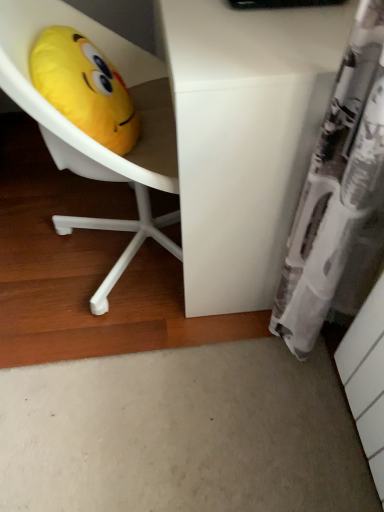
Question: Is yellow plush toy at upper left facing away from white matte desk at center?

Choices:
 (A) no
 (B) yes

Answer: (A)

Question: Would you say white matte desk at center is part of yellow plush toy at upper left's contents?

Choices:
 (A) no
 (B) yes

Answer: (A)

Question: Can you confirm if yellow plush toy at upper left is taller than white matte desk at center?

Choices:
 (A) yes
 (B) no

Answer: (B)

Question: From a real-world perspective, is yellow plush toy at upper left located beneath white matte desk at center?

Choices:
 (A) yes
 (B) no

Answer: (B)

Question: From the image's perspective, does yellow plush toy at upper left appear lower than white matte desk at center?

Choices:
 (A) no
 (B) yes

Answer: (B)

Question: Does yellow plush toy at upper left turn towards white matte desk at center?

Choices:
 (A) yes
 (B) no

Answer: (A)

Question: Considering the relative sizes of white matte desk at center and yellow plush toy at upper left in the image provided, is white matte desk at center taller than yellow plush toy at upper left?

Choices:
 (A) yes
 (B) no

Answer: (A)

Question: Can you confirm if white matte desk at center is smaller than yellow plush toy at upper left?

Choices:
 (A) yes
 (B) no

Answer: (B)

Question: Does white matte desk at center have a larger size compared to yellow plush toy at upper left?

Choices:
 (A) yes
 (B) no

Answer: (A)

Question: Are white matte desk at center and yellow plush toy at upper left making contact?

Choices:
 (A) yes
 (B) no

Answer: (B)

Question: Can you confirm if white matte desk at center is positioned to the left of yellow plush toy at upper left?

Choices:
 (A) yes
 (B) no

Answer: (B)

Question: Could yellow plush toy at upper left be considered to be inside white matte desk at center?

Choices:
 (A) yes
 (B) no

Answer: (B)

Question: Which is correct: white matte desk at center is inside yellow plush toy at upper left, or outside of it?

Choices:
 (A) outside
 (B) inside

Answer: (A)